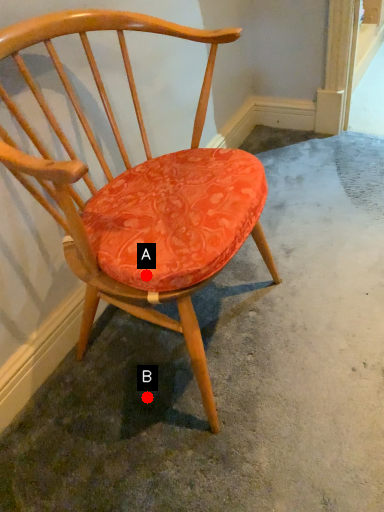
Question: Two points are circled on the image, labeled by A and B beside each circle. Which of the following is the closest to the observer?

Choices:
 (A) A is closer
 (B) B is closer

Answer: (A)